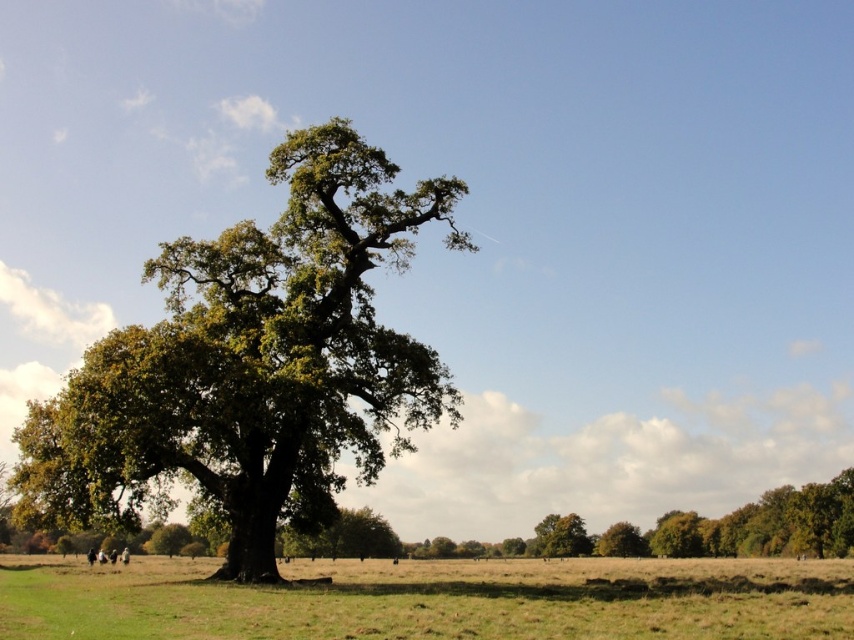
Is point (290, 385) behind point (186, 620)?

Yes, point (290, 385) is behind point (186, 620).

Who is higher up, green leafy oak tree at left or green grass at center?

green leafy oak tree at left

Does point (97, 504) lie behind point (519, 637)?

Yes, point (97, 504) is behind point (519, 637).

Where is `green leafy oak tree at left`? This screenshot has height=640, width=854. green leafy oak tree at left is located at coordinates (253, 364).